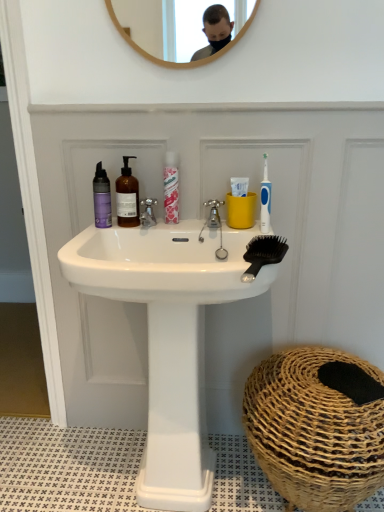
Question: From a real-world perspective, is brown woven basket at lower right located beneath white glossy sink at center?

Choices:
 (A) yes
 (B) no

Answer: (A)

Question: From a real-world perspective, is brown woven basket at lower right over white glossy sink at center?

Choices:
 (A) no
 (B) yes

Answer: (A)

Question: Is brown woven basket at lower right facing away from white glossy sink at center?

Choices:
 (A) no
 (B) yes

Answer: (A)

Question: Is brown woven basket at lower right oriented towards white glossy sink at center?

Choices:
 (A) yes
 (B) no

Answer: (B)

Question: From the image's perspective, is brown woven basket at lower right below white glossy sink at center?

Choices:
 (A) yes
 (B) no

Answer: (A)

Question: Is translucent amber bottle at center, which is counted as the second mouthwash, starting from the right, in front of or behind silver metallic faucet at center, arranged as the first tap when viewed from the left, in the image?

Choices:
 (A) behind
 (B) front

Answer: (B)

Question: Considering the positions of translucent amber bottle at center, acting as the 2th mouthwash starting from the left, and silver metallic faucet at center, arranged as the first tap when viewed from the left, in the image, is translucent amber bottle at center, acting as the 2th mouthwash starting from the left, wider or thinner than silver metallic faucet at center, arranged as the first tap when viewed from the left,?

Choices:
 (A) thin
 (B) wide

Answer: (A)

Question: Based on their positions, is translucent amber bottle at center, which is counted as the second mouthwash, starting from the right, located to the left or right of silver metallic faucet at center, arranged as the first tap when viewed from the left?

Choices:
 (A) left
 (B) right

Answer: (A)

Question: Considering the positions of translucent amber bottle at center, acting as the 2th mouthwash starting from the left, and silver metallic faucet at center, arranged as the first tap when viewed from the left, in the image, is translucent amber bottle at center, acting as the 2th mouthwash starting from the left, bigger or smaller than silver metallic faucet at center, arranged as the first tap when viewed from the left,?

Choices:
 (A) small
 (B) big

Answer: (B)

Question: Is point (97, 207) closer or farther from the camera than point (269, 211)?

Choices:
 (A) closer
 (B) farther

Answer: (A)

Question: Based on their sizes in the image, would you say purple matte bottle at left, which is the first mouthwash in left-to-right order, is bigger or smaller than blue plastic toothbrush at upper right?

Choices:
 (A) small
 (B) big

Answer: (B)

Question: In the image, is purple matte bottle at left, which is the first mouthwash in left-to-right order, positioned in front of or behind blue plastic toothbrush at upper right?

Choices:
 (A) behind
 (B) front

Answer: (A)

Question: Looking at their shapes, would you say purple matte bottle at left, which is the first mouthwash in left-to-right order, is wider or thinner than blue plastic toothbrush at upper right?

Choices:
 (A) wide
 (B) thin

Answer: (A)

Question: Is point (263, 200) positioned closer to the camera than point (283, 245)?

Choices:
 (A) farther
 (B) closer

Answer: (A)

Question: Based on their positions, is blue plastic toothbrush at upper right located to the left or right of black plastic comb at upper right?

Choices:
 (A) left
 (B) right

Answer: (B)